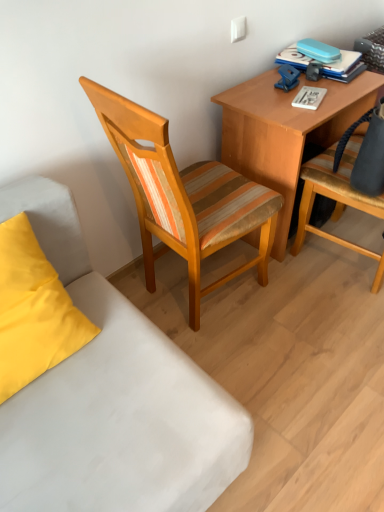
Question: Looking at the image, does striped fabric chair at right, the first chair viewed from the right, seem bigger or smaller compared to woodenchair at center, the first chair when ordered from left to right?

Choices:
 (A) big
 (B) small

Answer: (B)

Question: From their relative heights in the image, would you say striped fabric chair at right, placed as the 2th chair when sorted from left to right, is taller or shorter than woodenchair at center, the first chair when ordered from left to right?

Choices:
 (A) tall
 (B) short

Answer: (B)

Question: Which object is the closest to the white fabric couch at lower left?

Choices:
 (A) wooden desk at upper right
 (B) blue hardcover book at upper right
 (C) striped fabric chair at right, the first chair viewed from the right
 (D) matte yellow pillow at lower left
 (E) woodenchair at center, marked as the second chair in a right-to-left arrangement

Answer: (D)

Question: Which is farther from the woodenchair at center, the first chair when ordered from left to right?

Choices:
 (A) striped fabric chair at right, the first chair viewed from the right
 (B) matte yellow pillow at lower left
 (C) white fabric couch at lower left
 (D) wooden desk at upper right
 (E) blue hardcover book at upper right

Answer: (E)